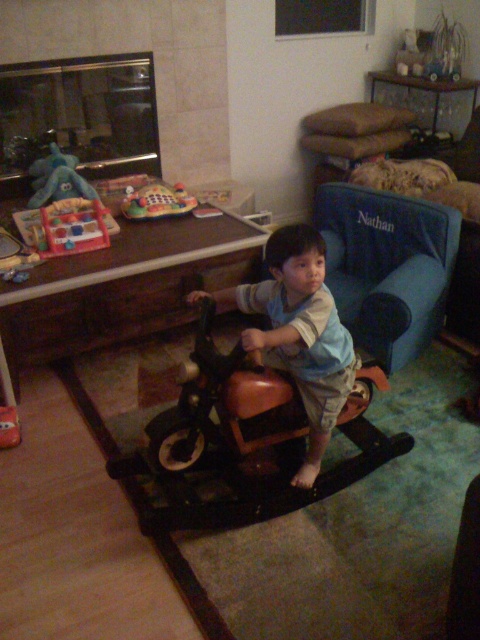
In the scene shown: You are a parent trying to locate your child Nathan. He mentioned he left his favorite blue plush elephant at upper left on the brown leather motorcycle at center. Based on the scene, is this possible?

The brown leather motorcycle at center is to the right of the blue plush elephant at upper left, so the blue plush elephant at upper left cannot be placed on the brown leather motorcycle at center since they are positioned apart from each other.

You are a parent trying to move the plastic colorful play mat at center to a different location. To do this, you need to first move the brown leather motorcycle at center out of the way. Is the motorcycle blocking the play mat?

The brown leather motorcycle at center is in front of the plastic colorful play mat at center, so yes, the motorcycle is blocking the play mat and needs to be moved first.